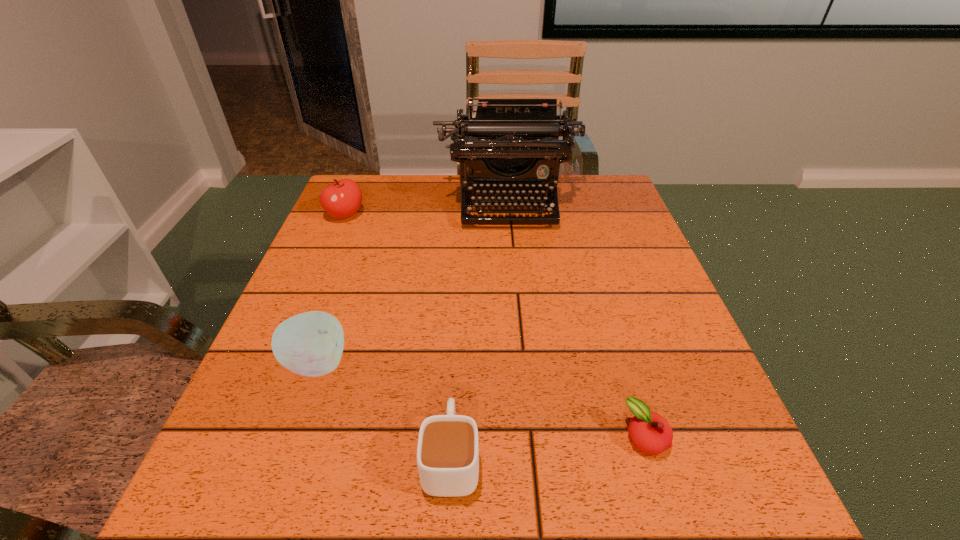
Locate an element on the screen. Image resolution: width=960 pixels, height=540 pixels. free space between the shortest apple and the third farthest object is located at coordinates (481, 400).

In order to click on free point between the typewriter and the farthest apple in this screenshot , I will do `click(426, 207)`.

You are a GUI agent. You are given a task and a screenshot of the screen. Output one action in this format:
    pyautogui.click(x=<x>, y=<y>)
    Task: Click on the unoccupied area between the farthest apple and the second nearest apple
    The height and width of the screenshot is (540, 960).
    Given the screenshot: What is the action you would take?
    click(331, 289)

The image size is (960, 540). I want to click on blank region between the third farthest object and the shortest object, so click(x=481, y=400).

At what (x,y) coordinates should I click in order to perform the action: click on free point between the cup and the third farthest object. Please return your answer as a coordinate pair (x, y). The height and width of the screenshot is (540, 960). Looking at the image, I should click on (384, 410).

You are a GUI agent. You are given a task and a screenshot of the screen. Output one action in this format:
    pyautogui.click(x=<x>, y=<y>)
    Task: Click on the free space between the rightmost apple and the farthest apple
    
    Given the screenshot: What is the action you would take?
    pyautogui.click(x=495, y=326)

The height and width of the screenshot is (540, 960). I want to click on the second closest object to the typewriter, so click(310, 344).

At what (x,y) coordinates should I click in order to perform the action: click on object that is the third closest one to the tallest object. Please return your answer as a coordinate pair (x, y). The image size is (960, 540). Looking at the image, I should click on (651, 433).

The image size is (960, 540). Find the location of `apple that stands as the second closest to the typewriter`. apple that stands as the second closest to the typewriter is located at coordinates (310, 344).

You are a GUI agent. You are given a task and a screenshot of the screen. Output one action in this format:
    pyautogui.click(x=<x>, y=<y>)
    Task: Click on the apple that can be found as the closest to the third farthest object
    
    Given the screenshot: What is the action you would take?
    point(342,199)